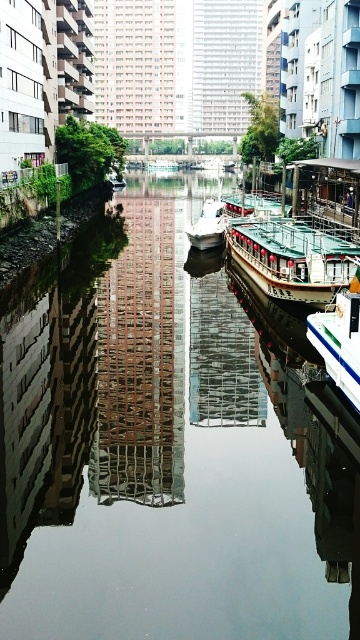
You are standing at the edge of the canal and see two points marked in the image. Which point is closer to you, point [109,429] or point [342,369]?

Point [109,429] is closer to you because it is further to the viewer than point [342,369].

You are a tourist planning to take a boat tour along the canal. You see the wooden polished boat at center and the white glossy boat at right. Which boat should you choose if you want a larger vessel for more space?

The wooden polished boat at center is bigger than the white glossy boat at right, so you should choose the wooden polished boat at center for a larger vessel with more space.

You are standing at the edge of the canal and want to take a photo of the wooden polished boat at center. If your camera has a maximum focus range of 20 meters, will it be able to capture the boat clearly?

The wooden polished boat at center is 22.81 meters away from the camera, which exceeds the maximum focus range of 20 meters. Therefore, the camera won